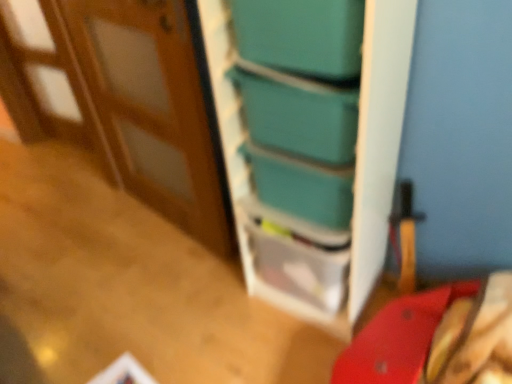
This screenshot has width=512, height=384. I want to click on teal plastic bookshelf at center, so (x=311, y=142).

Is teal plastic drawer at center turned away from smooth red table at lower right?

No, teal plastic drawer at center's orientation is not away from smooth red table at lower right.

From a real-world perspective, is teal plastic drawer at center above or below smooth red table at lower right?

From a real-world perspective, teal plastic drawer at center is physically above smooth red table at lower right.

From the picture: Does teal plastic drawer at center have a greater height compared to smooth red table at lower right?

Correct, teal plastic drawer at center is much taller as smooth red table at lower right.

Consider the image. Which is in front, teal plastic drawer at center or smooth red table at lower right?

smooth red table at lower right.

Is teal plastic box at upper center, the second box from the bottom, aimed at teal plastic drawer at center?

No, teal plastic box at upper center, the second box from the bottom, is not oriented towards teal plastic drawer at center.

Which of these two, teal plastic box at upper center, the second box from the bottom, or teal plastic drawer at center, is thinner?

teal plastic box at upper center, the second box from the bottom, is thinner.

From the image's perspective, between teal plastic box at upper center, which is the 1th box in top-to-bottom order, and teal plastic drawer at center, who is located below?

teal plastic drawer at center appears lower in the image.

Is teal plastic box at upper center, which is the 1th box in top-to-bottom order, taller or shorter than teal plastic drawer at center?

Considering their sizes, teal plastic box at upper center, which is the 1th box in top-to-bottom order, has less height than teal plastic drawer at center.

From the image's perspective, is smooth red table at lower right under teal plastic box at upper center, which is the 1th box in top-to-bottom order?

Indeed, from the image's perspective, smooth red table at lower right is shown beneath teal plastic box at upper center, which is the 1th box in top-to-bottom order.

From a real-world perspective, which is physically below, smooth red table at lower right or teal plastic box at upper center, which is the 1th box in top-to-bottom order?

smooth red table at lower right.

Does smooth red table at lower right have a lesser height compared to teal plastic box at upper center, the second box from the bottom?

Correct, smooth red table at lower right is not as tall as teal plastic box at upper center, the second box from the bottom.

Is smooth red table at lower right oriented towards teal plastic box at upper center, which is the 1th box in top-to-bottom order?

No.

Is teal plastic box at center, placed as the first box when sorted from bottom to top, directly adjacent to smooth red table at lower right?

teal plastic box at center, placed as the first box when sorted from bottom to top, and smooth red table at lower right are clearly separated.

From the image's perspective, is teal plastic box at center, which is the 2th box in top-to-bottom order, located above or below smooth red table at lower right?

Clearly, from the image's perspective, teal plastic box at center, which is the 2th box in top-to-bottom order, is above smooth red table at lower right.

How many degrees apart are the facing directions of teal plastic drawer at center and wooden at left?

25.3 degrees separate the facing orientations of teal plastic drawer at center and wooden at left.

Based on their sizes in the image, would you say teal plastic drawer at center is bigger or smaller than wooden at left?

teal plastic drawer at center is smaller than wooden at left.

Looking at this image, from a real-world perspective, which object stands above the other?

wooden at left.

Which of these two, teal plastic drawer at center or wooden at left, is thinner?

With smaller width is wooden at left.

You are a GUI agent. You are given a task and a screenshot of the screen. Output one action in this format:
    pyautogui.click(x=<x>, y=<y>)
    Task: Click on the door below the teal plastic box at upper center, which is the 1th box in top-to-bottom order (from a real-world perspective)
    This screenshot has height=384, width=512.
    Given the screenshot: What is the action you would take?
    pyautogui.click(x=152, y=108)

From the image's perspective, which one is positioned higher, teal plastic box at upper center, which is the 1th box in top-to-bottom order, or wooden at left?

teal plastic box at upper center, which is the 1th box in top-to-bottom order, appears higher in the image.

Looking at this image, is teal plastic box at upper center, which is the 1th box in top-to-bottom order, bigger than wooden at left?

No.

Is teal plastic box at upper center, the second box from the bottom, taller than wooden at left?

In fact, teal plastic box at upper center, the second box from the bottom, may be shorter than wooden at left.

Is wooden at left aimed at teal plastic box at center, placed as the first box when sorted from bottom to top?

No, wooden at left is not aimed at teal plastic box at center, placed as the first box when sorted from bottom to top.

From a real-world perspective, relative to teal plastic box at center, placed as the first box when sorted from bottom to top, is wooden at left vertically above or below?

From a real-world perspective, wooden at left is physically above teal plastic box at center, placed as the first box when sorted from bottom to top.

Which box is the 2nd one when counting from the right side of the wooden at left? Please provide its 2D coordinates.

[(301, 185)]

Can you tell me how much wooden at left and teal plastic box at center, placed as the first box when sorted from bottom to top, differ in facing direction?

25.3 degrees separate the facing orientations of wooden at left and teal plastic box at center, placed as the first box when sorted from bottom to top.

Identify the location of table in front of the teal plastic drawer at center. [127, 288].

Locate an element on the screen. This screenshot has width=512, height=384. drawer below the teal plastic box at upper center, which is the 1th box in top-to-bottom order (from the image's perspective) is located at coordinates (297, 255).

Looking at the image, which one is located closer to teal plastic box at upper center, the second box from the bottom, smooth red table at lower right or teal plastic bookshelf at center?

Based on the image, teal plastic bookshelf at center appears to be nearer to teal plastic box at upper center, the second box from the bottom.

Estimate the real-world distances between objects in this image. Which object is further from smooth red table at lower right, teal plastic box at center, which is the 2th box in top-to-bottom order, or teal plastic drawer at center?

teal plastic box at center, which is the 2th box in top-to-bottom order, is further to smooth red table at lower right.

Which object lies further to the anchor point teal plastic box at center, which is the 2th box in top-to-bottom order, teal plastic drawer at center or wooden at left?

wooden at left lies further to teal plastic box at center, which is the 2th box in top-to-bottom order, than the other object.

Which object lies nearer to the anchor point smooth red table at lower right, wooden at left or teal plastic box at center, placed as the first box when sorted from bottom to top?

Among the two, wooden at left is located nearer to smooth red table at lower right.

In the scene shown: When comparing their distances from teal plastic box at upper center, the second box from the bottom, does smooth red table at lower right or wooden at left seem closer?

The object closer to teal plastic box at upper center, the second box from the bottom, is wooden at left.

Looking at the image, which one is located further to teal plastic box at center, which is the 2th box in top-to-bottom order, smooth red table at lower right or teal plastic drawer at center?

Among the two, smooth red table at lower right is located further to teal plastic box at center, which is the 2th box in top-to-bottom order.

Considering their positions, is wooden at left positioned further to teal plastic bookshelf at center than teal plastic drawer at center?

wooden at left is further to teal plastic bookshelf at center.

Looking at the image, which one is located closer to wooden at left, teal plastic box at center, placed as the first box when sorted from bottom to top, or teal plastic bookshelf at center?

teal plastic bookshelf at center is closer to wooden at left.

Locate an element on the screen. This screenshot has height=384, width=512. bookshelf between smooth red table at lower right and teal plastic drawer at center from left to right is located at coordinates (311, 142).

Find the location of a particular element. bookshelf between teal plastic box at upper center, which is the 1th box in top-to-bottom order, and teal plastic drawer at center in the up-down direction is located at coordinates (311, 142).

You are a GUI agent. You are given a task and a screenshot of the screen. Output one action in this format:
    pyautogui.click(x=<x>, y=<y>)
    Task: Click on the door between teal plastic box at upper center, which is the 1th box in top-to-bottom order, and smooth red table at lower right, in the vertical direction
    The image size is (512, 384).
    Given the screenshot: What is the action you would take?
    pyautogui.click(x=152, y=108)

Locate an element on the screen. This screenshot has height=384, width=512. box between teal plastic box at upper center, which is the 1th box in top-to-bottom order, and teal plastic bookshelf at center from top to bottom is located at coordinates (301, 185).